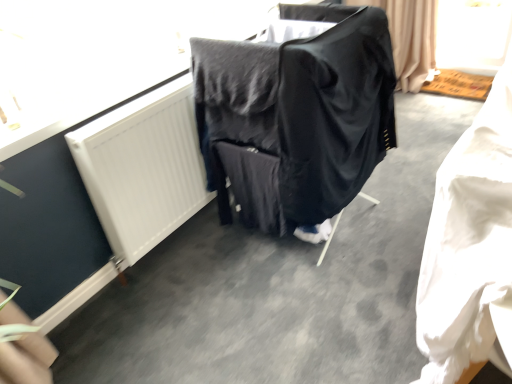
Question: Considering the relative positions of black fabric-covered chair at center and white fabric at lower right in the image provided, is black fabric-covered chair at center to the left or to the right of white fabric at lower right?

Choices:
 (A) left
 (B) right

Answer: (A)

Question: Looking at their shapes, would you say black fabric-covered chair at center is wider or thinner than white fabric at lower right?

Choices:
 (A) thin
 (B) wide

Answer: (B)

Question: Which is farther from the white fabric at lower right?

Choices:
 (A) black fabric-covered chair at center
 (B) white matte radiator at upper left

Answer: (B)

Question: Considering the real-world distances, which object is farthest from the black fabric-covered chair at center?

Choices:
 (A) white matte radiator at upper left
 (B) white fabric at lower right

Answer: (B)